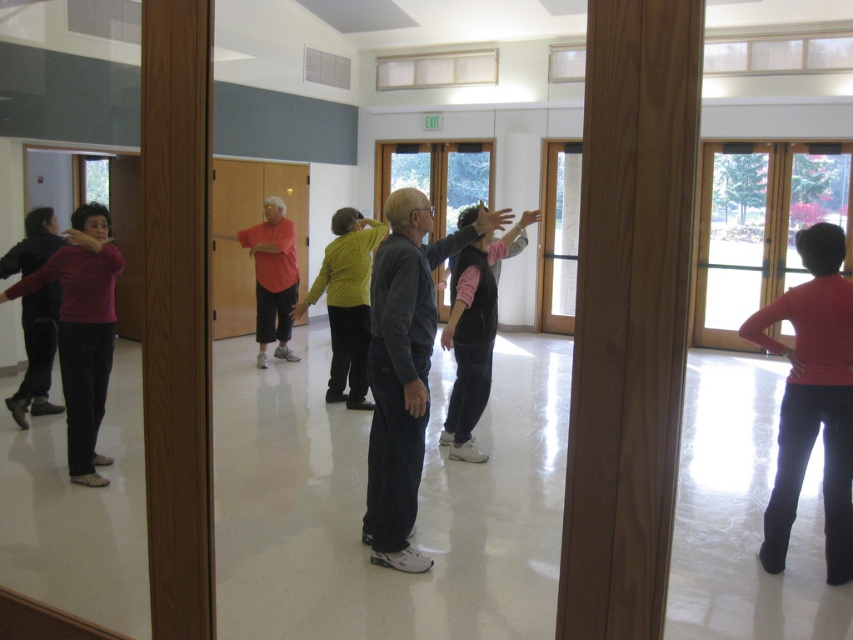
You are an observer in the room and you see two people wearing the matte red sweater at right and the matte black sweater at left. Which person is wearing the larger sweater?

The person wearing the matte red sweater at right is wearing the larger sweater because the matte red sweater at right is bigger than the matte black sweater at left.

You are standing in the room and see two points marked in the scene. Which point is closer to you, point (x=840, y=577) or point (x=33, y=388)?

Point (x=840, y=577) is closer to the viewer than point (x=33, y=388).